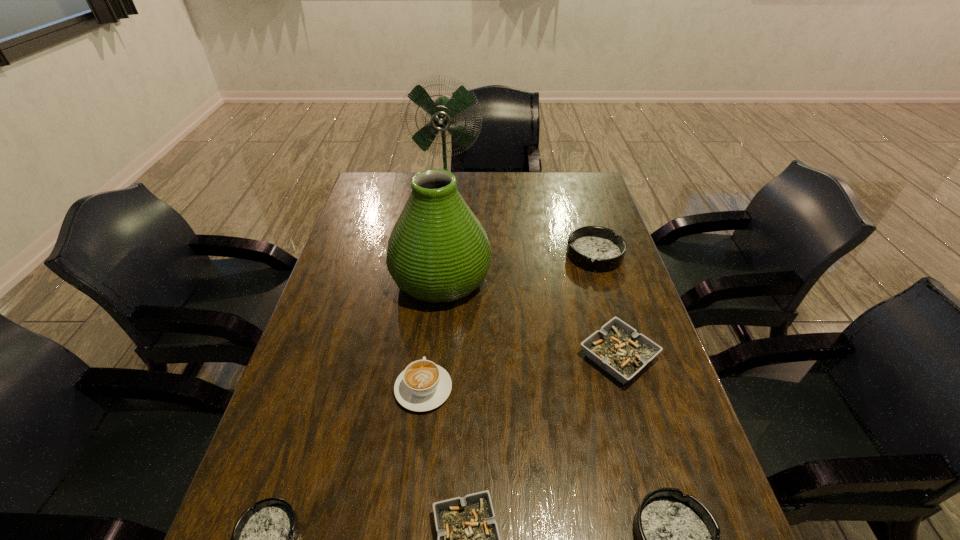
I want to click on dark ashtray that is the second closest to the vase, so click(264, 538).

The image size is (960, 540). Identify the location of dark ashtray that is the second closest to the green vase. (264, 538).

At what (x,y) coordinates should I click in order to perform the action: click on free point that satisfies the following two spatial constraints: 1. on the side of the seventh shortest object with the handle; 2. on the right side of the white cappuccino. Please return your answer as a coordinate pair (x, y). Image resolution: width=960 pixels, height=540 pixels. Looking at the image, I should click on (436, 278).

This screenshot has height=540, width=960. In order to click on free spot that satisfies the following two spatial constraints: 1. on the front-facing side of the tallest object; 2. on the right side of the farther gray ashtray in this screenshot , I will do `click(429, 357)`.

Image resolution: width=960 pixels, height=540 pixels. What are the coordinates of `blank area in the image that satisfies the following two spatial constraints: 1. on the side of the cappuccino with the handle; 2. on the right side of the bigger gray ashtray` in the screenshot? It's located at (427, 357).